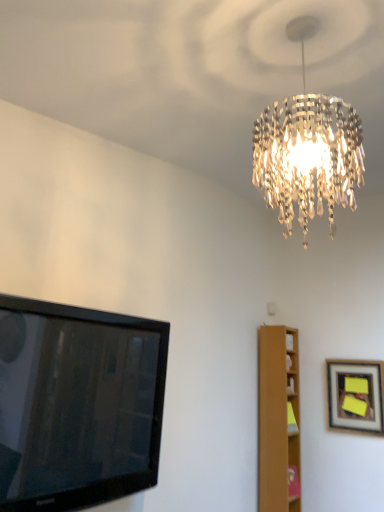
Question: Is the depth of light brown wooden bookshelf at right less than that of wooden framed picture at right?

Choices:
 (A) yes
 (B) no

Answer: (B)

Question: Considering the relative sizes of light brown wooden bookshelf at right and wooden framed picture at right in the image provided, is light brown wooden bookshelf at right taller than wooden framed picture at right?

Choices:
 (A) yes
 (B) no

Answer: (A)

Question: Is light brown wooden bookshelf at right bigger than wooden framed picture at right?

Choices:
 (A) yes
 (B) no

Answer: (A)

Question: From a real-world perspective, does light brown wooden bookshelf at right stand above wooden framed picture at right?

Choices:
 (A) no
 (B) yes

Answer: (A)

Question: Could wooden framed picture at right be considered to be inside light brown wooden bookshelf at right?

Choices:
 (A) yes
 (B) no

Answer: (B)

Question: Can you see light brown wooden bookshelf at right touching wooden framed picture at right?

Choices:
 (A) yes
 (B) no

Answer: (B)

Question: From the image's perspective, is black glossy tv at left below light brown wooden bookshelf at right?

Choices:
 (A) no
 (B) yes

Answer: (A)

Question: Does black glossy tv at left have a smaller size compared to light brown wooden bookshelf at right?

Choices:
 (A) yes
 (B) no

Answer: (B)

Question: Is light brown wooden bookshelf at right surrounded by black glossy tv at left?

Choices:
 (A) no
 (B) yes

Answer: (A)

Question: Is black glossy tv at left aimed at light brown wooden bookshelf at right?

Choices:
 (A) yes
 (B) no

Answer: (B)

Question: Is light brown wooden bookshelf at right at the back of black glossy tv at left?

Choices:
 (A) no
 (B) yes

Answer: (A)

Question: Is black glossy tv at left far from light brown wooden bookshelf at right?

Choices:
 (A) yes
 (B) no

Answer: (A)

Question: Is black glossy tv at left turned away from wooden framed picture at right?

Choices:
 (A) yes
 (B) no

Answer: (B)